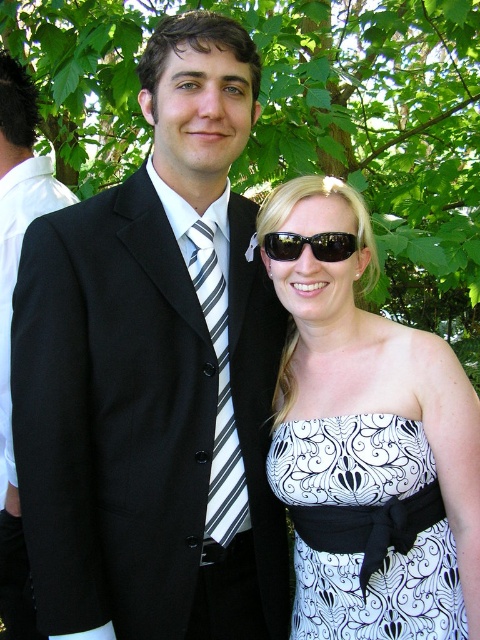
Question: Which is farther from the black satin suit at left?

Choices:
 (A) green leafy tree at upper center
 (B) black suit at left
 (C) striped fabric tie at center

Answer: (A)

Question: Does white printed fabric dress at center appear on the right side of striped fabric tie at center?

Choices:
 (A) no
 (B) yes

Answer: (B)

Question: Is white printed fabric dress at center thinner than black satin suit at left?

Choices:
 (A) yes
 (B) no

Answer: (B)

Question: Which of the following is the closest to the observer?

Choices:
 (A) striped fabric tie at center
 (B) black plastic sunglasses at center
 (C) black suit at left

Answer: (C)

Question: Can you confirm if black suit at left is smaller than white printed fabric dress at center?

Choices:
 (A) yes
 (B) no

Answer: (B)

Question: Which point appears farthest from the camera in this image?

Choices:
 (A) click(x=456, y=577)
 (B) click(x=172, y=10)

Answer: (B)